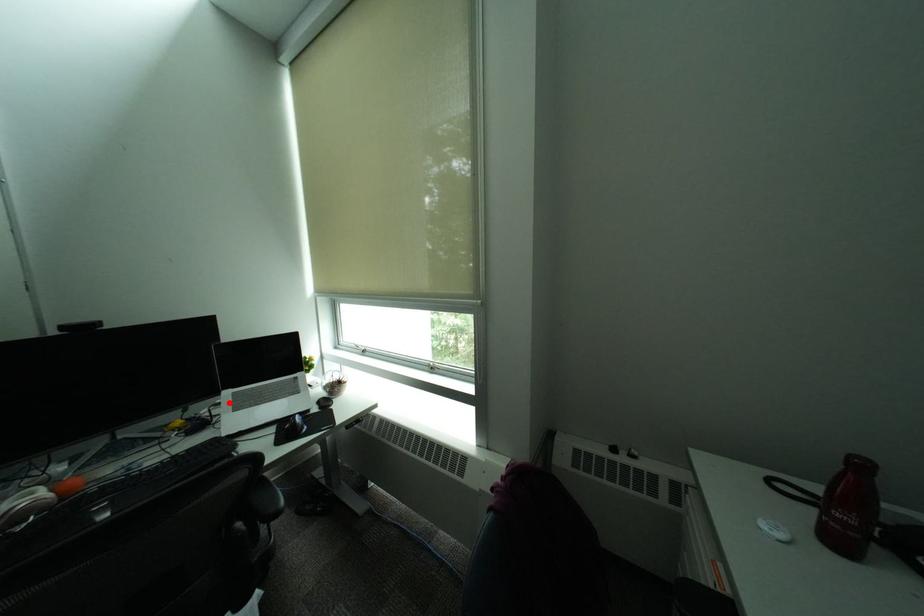
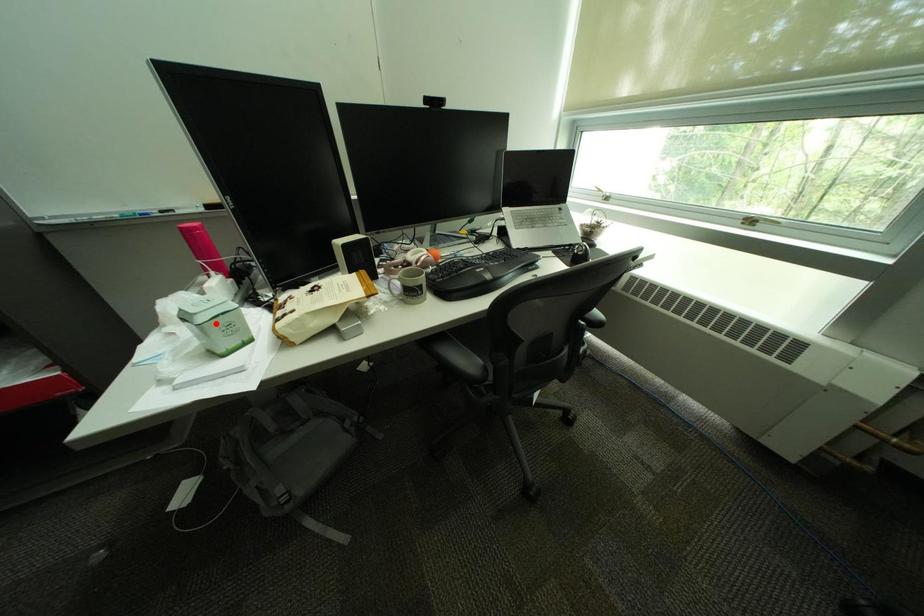
I am providing you with two images of the same scene from different viewpoints. A red point is marked on the first image and another point is marked on the second image. Is the red point in image1 aligned with the point shown in image2?

No